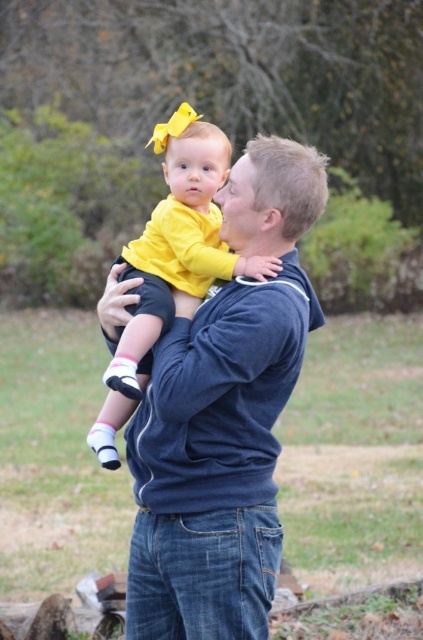
You are a photographer trying to capture a photo of the blue cotton hoodie at center and the yellow matte shirt at center. Which object should you focus on first to ensure both are in sharp focus?

The blue cotton hoodie at center is closer to the viewer than the yellow matte shirt at center, so focus on the blue cotton hoodie at center first to ensure both are in sharp focus.

You are a photographer trying to capture a closeup of the blue cotton hoodie at center and the yellow matte shirt at center. Since the camera can only focus on one subject at a time, which item should you focus on first if you want to ensure the one that is closer to the camera is sharp?

The blue cotton hoodie at center is below the yellow matte shirt at center, so it is closer to the camera. Therefore, you should focus on the blue cotton hoodie at center first to ensure it is sharp.